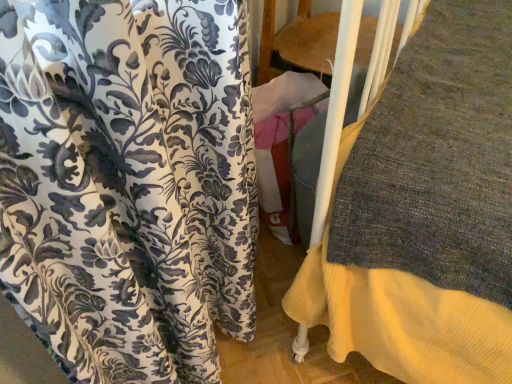
Describe the element at coordinates (128, 183) in the screenshot. I see `floral fabric curtain at left` at that location.

The height and width of the screenshot is (384, 512). In order to click on floral fabric curtain at left in this screenshot , I will do `click(128, 183)`.

This screenshot has height=384, width=512. Identify the location of wooden bunk bed at center. (337, 107).

This screenshot has height=384, width=512. Describe the element at coordinates (337, 107) in the screenshot. I see `wooden bunk bed at center` at that location.

Locate an element on the screen. This screenshot has height=384, width=512. floral fabric curtain at left is located at coordinates (128, 183).

Is wooden bunk bed at center to the left or to the right of floral fabric curtain at left in the image?

wooden bunk bed at center is positioned on floral fabric curtain at left's right side.

Relative to floral fabric curtain at left, is wooden bunk bed at center in front or behind?

Clearly, wooden bunk bed at center is behind floral fabric curtain at left.

Does point (334, 90) come behind point (104, 64)?

Yes.

From the image's perspective, relative to floral fabric curtain at left, is wooden bunk bed at center above or below?

Based on their image positions, wooden bunk bed at center is located above floral fabric curtain at left.

From a real-world perspective, which is physically below, wooden bunk bed at center or floral fabric curtain at left?

wooden bunk bed at center.

Considering the sizes of objects wooden bunk bed at center and floral fabric curtain at left in the image provided, who is thinner, wooden bunk bed at center or floral fabric curtain at left?

wooden bunk bed at center is thinner.

Considering the relative sizes of wooden bunk bed at center and floral fabric curtain at left in the image provided, is wooden bunk bed at center taller than floral fabric curtain at left?

Yes, wooden bunk bed at center is taller than floral fabric curtain at left.

Between wooden bunk bed at center and floral fabric curtain at left, which one has smaller size?

floral fabric curtain at left is smaller.

Can we say wooden bunk bed at center lies outside floral fabric curtain at left?

Yes, wooden bunk bed at center is outside of floral fabric curtain at left.

Is there a large distance between wooden bunk bed at center and floral fabric curtain at left?

Actually, wooden bunk bed at center and floral fabric curtain at left are a little close together.

Is floral fabric curtain at left at the back of wooden bunk bed at center?

No, wooden bunk bed at center's orientation is not away from floral fabric curtain at left.

Locate an element on the screen. This screenshot has width=512, height=384. bunk bed behind the floral fabric curtain at left is located at coordinates (337, 107).

Consider the image. Visually, is floral fabric curtain at left positioned to the left or to the right of wooden bunk bed at center?

floral fabric curtain at left is positioned on wooden bunk bed at center's left side.

Is the position of floral fabric curtain at left less distant than that of wooden bunk bed at center?

Yes, it is.

Which point is more distant from viewer, [197,329] or [393,44]?

The point [393,44] is farther.

From the image's perspective, is floral fabric curtain at left located above or below wooden bunk bed at center?

From the image's perspective, floral fabric curtain at left appears below wooden bunk bed at center.

From a real-world perspective, does floral fabric curtain at left sit lower than wooden bunk bed at center?

Actually, floral fabric curtain at left is physically above wooden bunk bed at center in the real world.

Looking at their sizes, would you say floral fabric curtain at left is wider or thinner than wooden bunk bed at center?

In the image, floral fabric curtain at left appears to be wider than wooden bunk bed at center.

Between floral fabric curtain at left and wooden bunk bed at center, which one has more height?

Standing taller between the two is wooden bunk bed at center.

Based on their sizes in the image, would you say floral fabric curtain at left is bigger or smaller than wooden bunk bed at center?

Clearly, floral fabric curtain at left is smaller in size than wooden bunk bed at center.

Choose the correct answer: Is floral fabric curtain at left inside wooden bunk bed at center or outside it?

floral fabric curtain at left cannot be found inside wooden bunk bed at center.

Are floral fabric curtain at left and wooden bunk bed at center far apart?

floral fabric curtain at left is actually quite close to wooden bunk bed at center.

Could you tell me if floral fabric curtain at left is turned towards wooden bunk bed at center?

No, floral fabric curtain at left is not turned towards wooden bunk bed at center.

Can you tell me how much floral fabric curtain at left and wooden bunk bed at center differ in facing direction?

The angle between the facing direction of floral fabric curtain at left and the facing direction of wooden bunk bed at center is 2.53 degrees.

How distant is floral fabric curtain at left from wooden bunk bed at center?

The distance of floral fabric curtain at left from wooden bunk bed at center is 10.36 inches.

Where is `bunk bed behind the floral fabric curtain at left`? Image resolution: width=512 pixels, height=384 pixels. bunk bed behind the floral fabric curtain at left is located at coordinates [x=337, y=107].

Locate an element on the screen. The image size is (512, 384). bunk bed on the right of the floral fabric curtain at left is located at coordinates (337, 107).

Find the location of a particular element. The image size is (512, 384). curtain in front of the wooden bunk bed at center is located at coordinates (128, 183).